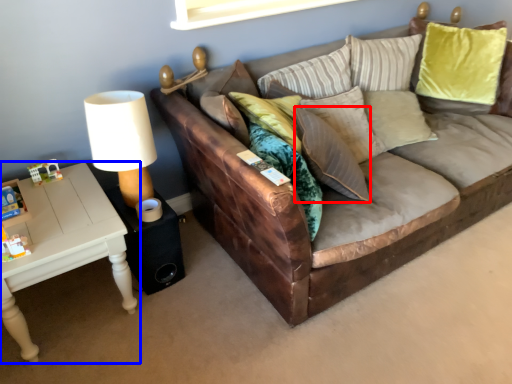
Question: Which object is further to the camera taking this photo, pillow (highlighted by a red box) or table (highlighted by a blue box)?

Choices:
 (A) pillow
 (B) table

Answer: (A)